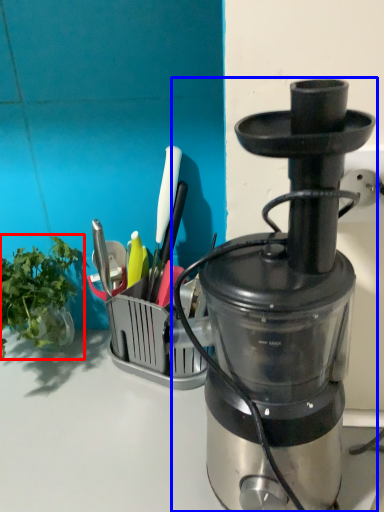
Question: Which object appears closest to the camera in this image, vegetable (highlighted by a red box) or blender (highlighted by a blue box)?

Choices:
 (A) vegetable
 (B) blender

Answer: (B)